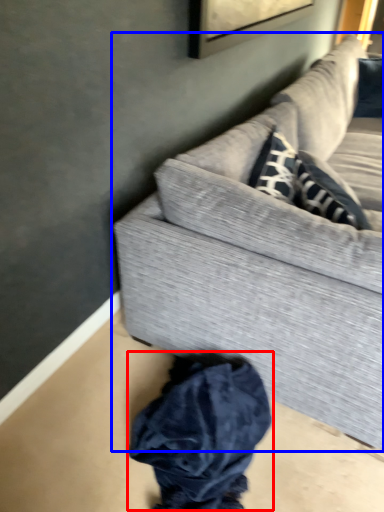
Question: Which object is closer to the camera taking this photo, clothing (highlighted by a red box) or studio couch (highlighted by a blue box)?

Choices:
 (A) clothing
 (B) studio couch

Answer: (B)